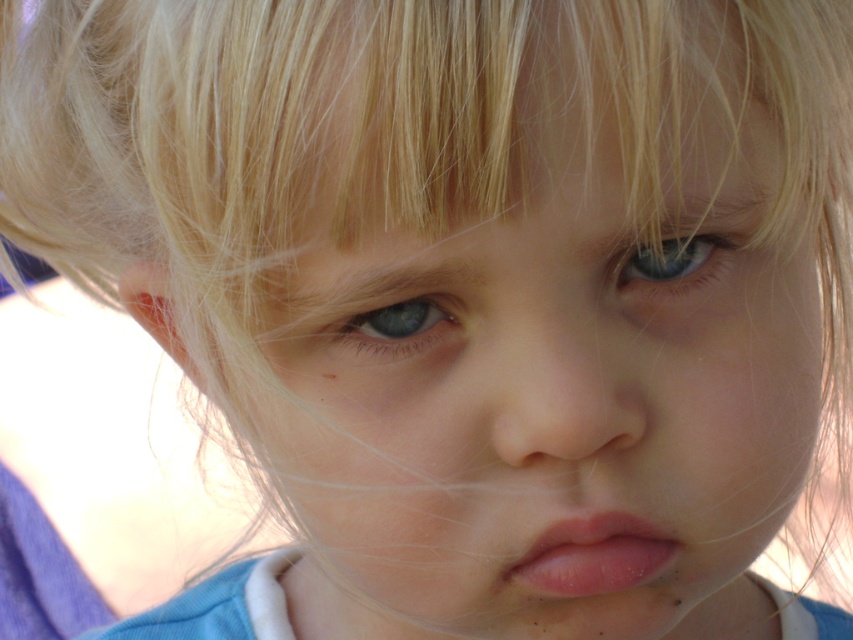
Does blue matte eye at center have a larger size compared to blue glossy eye at upper center?

Incorrect, blue matte eye at center is not larger than blue glossy eye at upper center.

Who is lower down, blue matte eye at center or blue glossy eye at upper center?

blue matte eye at center is below.

Which is behind, point (355, 348) or point (701, 268)?

Point (701, 268)

The height and width of the screenshot is (640, 853). I want to click on blue matte eye at center, so click(393, 326).

Locate an element on the screen. pink smooth lips at center is located at coordinates (592, 556).

Is point (621, 515) positioned in front of point (645, 262)?

Yes, point (621, 515) is closer to viewer.

Locate an element on the screen. This screenshot has width=853, height=640. pink smooth lips at center is located at coordinates (592, 556).

Which is in front, point (526, 561) or point (320, 332)?

Point (320, 332) is more forward.

Describe the element at coordinates (592, 556) in the screenshot. I see `pink smooth lips at center` at that location.

You are a GUI agent. You are given a task and a screenshot of the screen. Output one action in this format:
    pyautogui.click(x=<x>, y=<y>)
    Task: Click on the pink smooth lips at center
    The height and width of the screenshot is (640, 853).
    Given the screenshot: What is the action you would take?
    pyautogui.click(x=592, y=556)